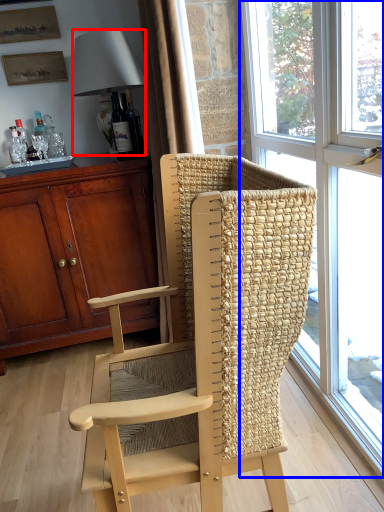
Question: Which object appears farthest to the camera in this image, lamp (highlighted by a red box) or window (highlighted by a blue box)?

Choices:
 (A) lamp
 (B) window

Answer: (A)